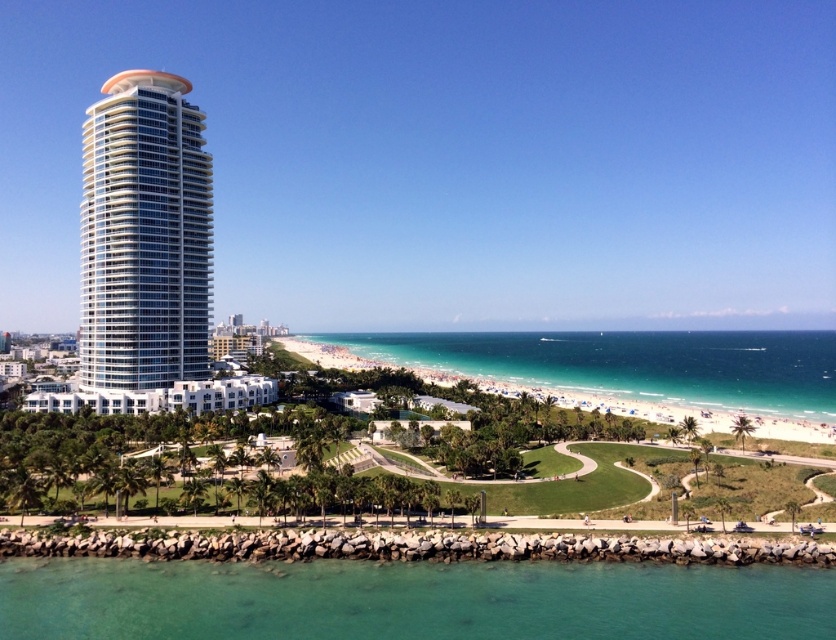
You are standing on the rocky breakwater and looking towards the white glass tower at left and the clear glass water at lower center. Which object is closer to your right side?

The clear glass water at lower center is positioned on the right side of white glass tower at left, so it is closer to your right side.

You are standing at the point closer to the camera in the image. Which point are you at, point (345, 566) or point (145, 172)?

You are at point (345, 566) because it is closer to the camera than point (145, 172).

You are standing at the center of the image and want to reach the clear glass water at lower center. According to the coordinates provided, in which direction should you move to get there?

The clear glass water at lower center is located at coordinates point (410,600), so you should move towards the lower center direction to reach it.